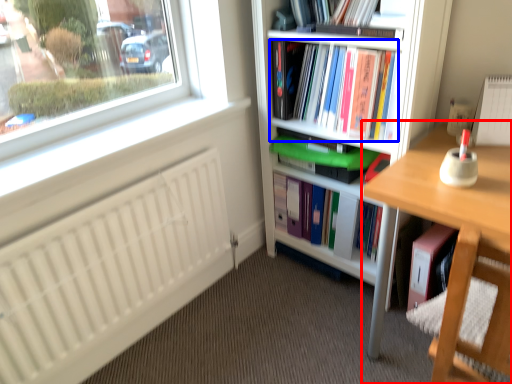
Question: Which of the following is the farthest to the observer, desk (highlighted by a red box) or book (highlighted by a blue box)?

Choices:
 (A) desk
 (B) book

Answer: (B)